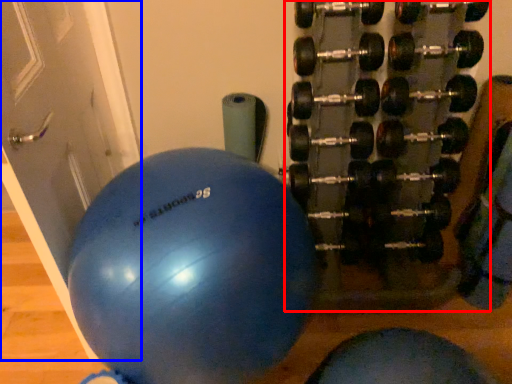
Question: Which object appears closest to the camera in this image, dumbbell (highlighted by a red box) or door (highlighted by a blue box)?

Choices:
 (A) dumbbell
 (B) door

Answer: (B)